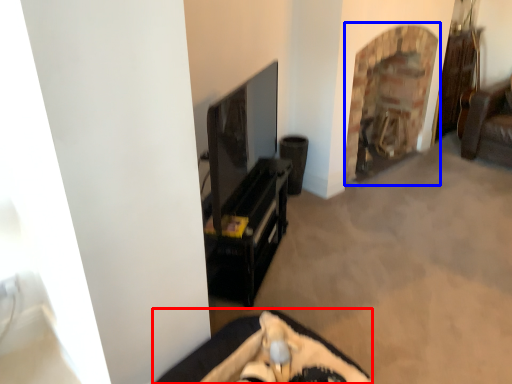
Question: Which object is further to the camera taking this photo, furniture (highlighted by a red box) or fireplace (highlighted by a blue box)?

Choices:
 (A) furniture
 (B) fireplace

Answer: (B)